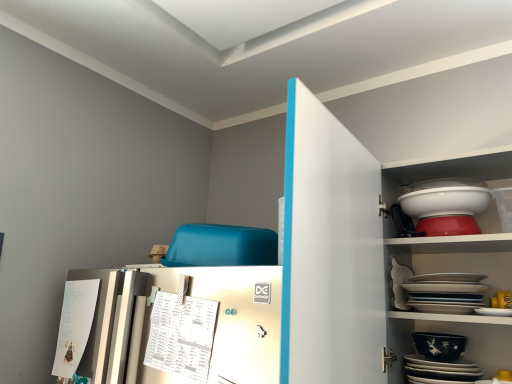
Question: Can you confirm if black glossy platter at lower right, the second platter positioned from the top, is thinner than black glossy bowl at lower right, placed as the 1th bowl when sorted from bottom to top?

Choices:
 (A) no
 (B) yes

Answer: (A)

Question: Considering the relative positions of black glossy platter at lower right, the second platter positioned from the top, and black glossy bowl at lower right, placed as the 1th bowl when sorted from bottom to top, in the image provided, is black glossy platter at lower right, the second platter positioned from the top, to the right of black glossy bowl at lower right, placed as the 1th bowl when sorted from bottom to top, from the viewer's perspective?

Choices:
 (A) yes
 (B) no

Answer: (B)

Question: From a real-world perspective, is black glossy platter at lower right, which ranks as the 1th platter in bottom-to-top order, under black glossy bowl at lower right, placed as the 1th bowl when sorted from bottom to top?

Choices:
 (A) yes
 (B) no

Answer: (A)

Question: Can you confirm if black glossy platter at lower right, the second platter positioned from the top, is taller than black glossy bowl at lower right, the second bowl viewed from the top?

Choices:
 (A) no
 (B) yes

Answer: (B)

Question: Is black glossy platter at lower right, which ranks as the 1th platter in bottom-to-top order, facing away from black glossy bowl at lower right, the second bowl viewed from the top?

Choices:
 (A) no
 (B) yes

Answer: (A)

Question: From a real-world perspective, is black glossy platter at lower right, which ranks as the 1th platter in bottom-to-top order, positioned over black glossy bowl at lower right, the second bowl viewed from the top, based on gravity?

Choices:
 (A) no
 (B) yes

Answer: (A)

Question: Is white glossy bowl at upper right, which is the first bowl in top-to-bottom order, turned away from black glossy platter at lower right, the second platter positioned from the top?

Choices:
 (A) yes
 (B) no

Answer: (B)

Question: From the image's perspective, does white glossy bowl at upper right, which is the first bowl in top-to-bottom order, appear lower than black glossy platter at lower right, which ranks as the 1th platter in bottom-to-top order?

Choices:
 (A) no
 (B) yes

Answer: (A)

Question: Is white glossy bowl at upper right, the second bowl ordered from the bottom, closer to the viewer compared to black glossy platter at lower right, which ranks as the 1th platter in bottom-to-top order?

Choices:
 (A) no
 (B) yes

Answer: (A)

Question: Considering the relative sizes of white glossy bowl at upper right, which is the first bowl in top-to-bottom order, and black glossy platter at lower right, the second platter positioned from the top, in the image provided, is white glossy bowl at upper right, which is the first bowl in top-to-bottom order, bigger than black glossy platter at lower right, the second platter positioned from the top,?

Choices:
 (A) no
 (B) yes

Answer: (A)

Question: Considering the relative positions of white glossy bowl at upper right, the second bowl ordered from the bottom, and black glossy platter at lower right, the second platter positioned from the top, in the image provided, is white glossy bowl at upper right, the second bowl ordered from the bottom, to the right of black glossy platter at lower right, the second platter positioned from the top, from the viewer's perspective?

Choices:
 (A) yes
 (B) no

Answer: (A)

Question: Considering the relative sizes of white glossy bowl at upper right, which is the first bowl in top-to-bottom order, and white glossy platter at upper right, acting as the second platter starting from the bottom, in the image provided, is white glossy bowl at upper right, which is the first bowl in top-to-bottom order, shorter than white glossy platter at upper right, acting as the second platter starting from the bottom,?

Choices:
 (A) yes
 (B) no

Answer: (A)